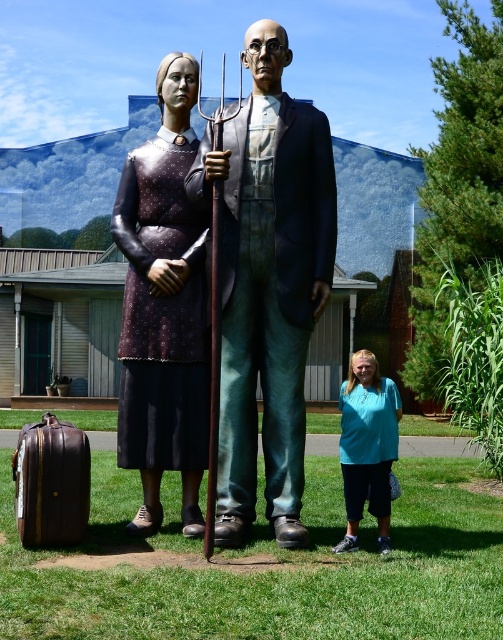
From the picture: You are an art curator planning to move the matte black dress at center and the teal fabric shirt at lower right to a new exhibition space. The new space has a narrow corridor that only allows items to pass if they are arranged in a straight line from left to right. Can you arrange them in such a way without rotating them? Explain your reasoning based on their positions in the current scene.

Yes, you can arrange the matte black dress at center and the teal fabric shirt at lower right in a straight line from left to right in the new exhibition space. In the current scene, the matte black dress at center is already positioned to the left of the teal fabric shirt at lower right, so maintaining this left to right order would allow them to pass through the narrow corridor without needing rotation.

You are a photographer trying to capture the polished bronze statue at center and the brown leather suitcase at lower left in a single frame. Based on their positions, will the statue appear higher or lower in the photo compared to the suitcase?

The polished bronze statue at center is located above the brown leather suitcase at lower left, so in the photo, the statue will appear higher than the suitcase.